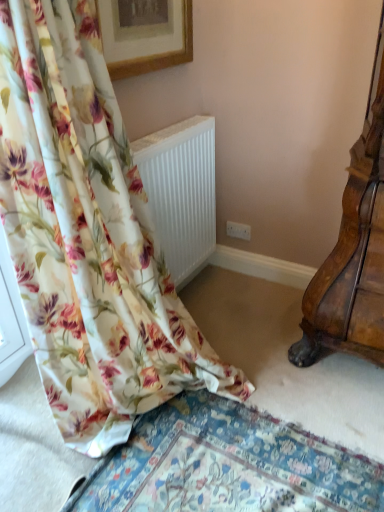
Question: Can you confirm if floral fabric curtain at left is taller than wooden picture frame at upper center?

Choices:
 (A) yes
 (B) no

Answer: (A)

Question: Can you confirm if floral fabric curtain at left is bigger than wooden picture frame at upper center?

Choices:
 (A) yes
 (B) no

Answer: (A)

Question: Is floral fabric curtain at left looking in the opposite direction of wooden picture frame at upper center?

Choices:
 (A) yes
 (B) no

Answer: (B)

Question: Is floral fabric curtain at left oriented towards wooden picture frame at upper center?

Choices:
 (A) no
 (B) yes

Answer: (A)

Question: From a real-world perspective, is floral fabric curtain at left physically above wooden picture frame at upper center?

Choices:
 (A) no
 (B) yes

Answer: (A)

Question: Considering the relative positions of floral fabric curtain at left and wooden picture frame at upper center in the image provided, is floral fabric curtain at left in front of wooden picture frame at upper center?

Choices:
 (A) no
 (B) yes

Answer: (B)

Question: Is wooden picture frame at upper center touching white ribbed radiator at lower left?

Choices:
 (A) no
 (B) yes

Answer: (A)

Question: Can you confirm if wooden picture frame at upper center is positioned to the right of white ribbed radiator at lower left?

Choices:
 (A) yes
 (B) no

Answer: (B)

Question: Would you say wooden picture frame at upper center is outside white ribbed radiator at lower left?

Choices:
 (A) yes
 (B) no

Answer: (A)

Question: Is wooden picture frame at upper center to the left of white ribbed radiator at lower left from the viewer's perspective?

Choices:
 (A) no
 (B) yes

Answer: (B)

Question: Considering the relative sizes of wooden picture frame at upper center and white ribbed radiator at lower left in the image provided, is wooden picture frame at upper center taller than white ribbed radiator at lower left?

Choices:
 (A) yes
 (B) no

Answer: (B)

Question: Considering the relative sizes of wooden picture frame at upper center and white ribbed radiator at lower left in the image provided, is wooden picture frame at upper center wider than white ribbed radiator at lower left?

Choices:
 (A) yes
 (B) no

Answer: (B)

Question: From the image's perspective, would you say white ribbed radiator at lower left is shown under wooden picture frame at upper center?

Choices:
 (A) yes
 (B) no

Answer: (A)